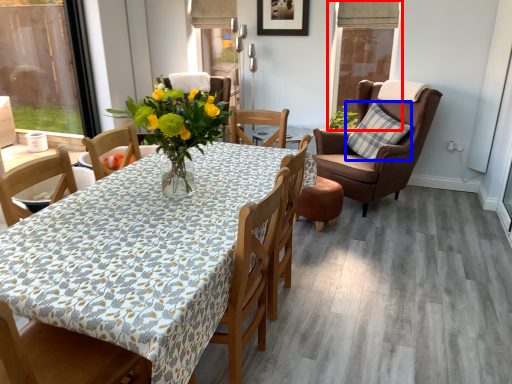
Question: Which point is closer to the camera, window screen (highlighted by a red box) or pillow (highlighted by a blue box)?

Choices:
 (A) window screen
 (B) pillow

Answer: (B)